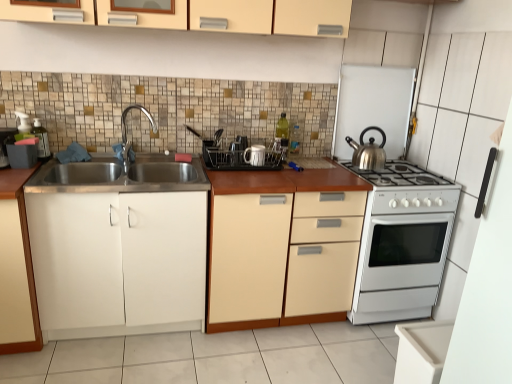
The width and height of the screenshot is (512, 384). Identify the location of vacant space to the right of white glossy mug at center, the 4th appliance viewed from the left. (284, 171).